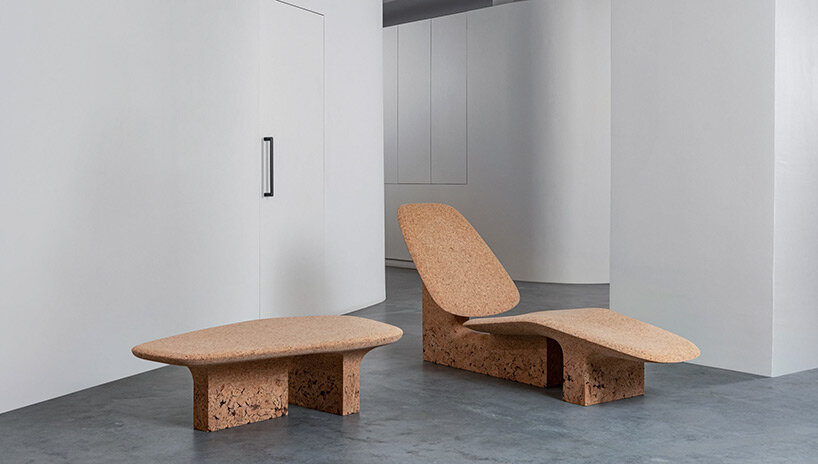
Find the location of a particular element. The height and width of the screenshot is (464, 818). bench is located at coordinates (x=286, y=332).